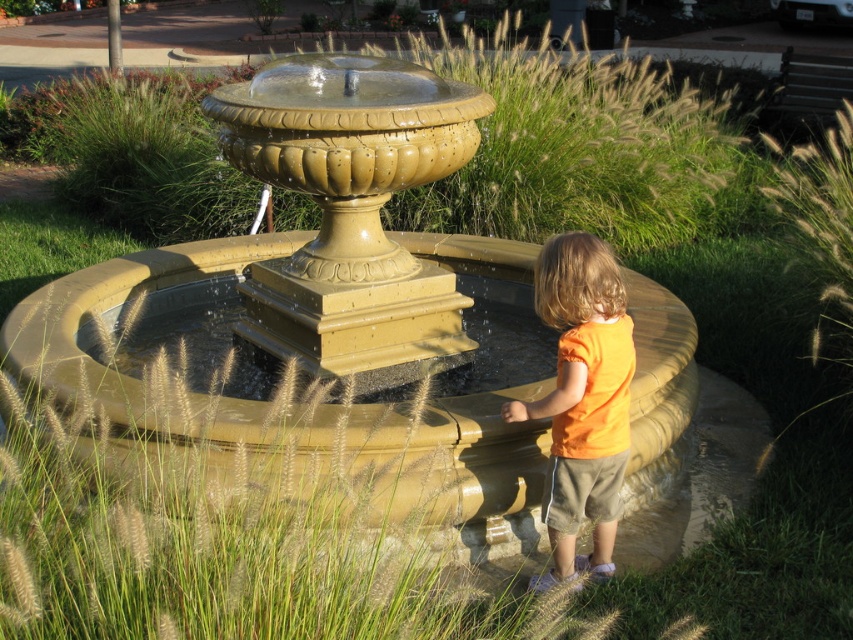
Between point (113, 340) and point (624, 465), which one is positioned in front?

Positioned in front is point (624, 465).

Is matte gold fountain at center wider than orange cotton shirt at right?

Yes, matte gold fountain at center is wider than orange cotton shirt at right.

Who is more forward, (379, 376) or (585, 394)?

Positioned in front is point (585, 394).

Find the location of a particular element. The width and height of the screenshot is (853, 640). matte gold fountain at center is located at coordinates (316, 326).